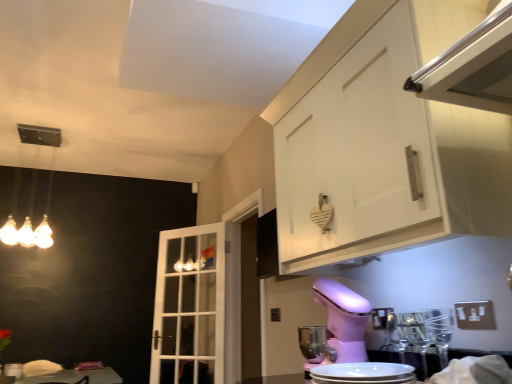
Question: From a real-world perspective, is white matte cabinet at upper right over matte glass light fixture at upper left?

Choices:
 (A) no
 (B) yes

Answer: (A)

Question: Is white matte cabinet at upper right closer to the viewer compared to matte glass light fixture at upper left?

Choices:
 (A) yes
 (B) no

Answer: (A)

Question: From a real-world perspective, is white matte cabinet at upper right below matte glass light fixture at upper left?

Choices:
 (A) no
 (B) yes

Answer: (B)

Question: From the image's perspective, is white matte cabinet at upper right beneath matte glass light fixture at upper left?

Choices:
 (A) yes
 (B) no

Answer: (B)

Question: Can you confirm if white matte cabinet at upper right is positioned to the left of matte glass light fixture at upper left?

Choices:
 (A) yes
 (B) no

Answer: (B)

Question: Is white matte cabinet at upper right bigger or smaller than matte glass light fixture at upper left?

Choices:
 (A) big
 (B) small

Answer: (A)

Question: Considering the positions of white matte cabinet at upper right and matte glass light fixture at upper left in the image, is white matte cabinet at upper right taller or shorter than matte glass light fixture at upper left?

Choices:
 (A) short
 (B) tall

Answer: (A)

Question: Is white matte cabinet at upper right to the left or to the right of matte glass light fixture at upper left in the image?

Choices:
 (A) left
 (B) right

Answer: (B)

Question: Is white matte cabinet at upper right inside the boundaries of matte glass light fixture at upper left, or outside?

Choices:
 (A) inside
 (B) outside

Answer: (B)

Question: From their relative heights in the image, would you say white glass door at center is taller or shorter than white matte cabinet at upper right?

Choices:
 (A) short
 (B) tall

Answer: (B)

Question: Is point (173, 347) closer or farther from the camera than point (338, 137)?

Choices:
 (A) closer
 (B) farther

Answer: (B)

Question: Choose the correct answer: Is white glass door at center inside white matte cabinet at upper right or outside it?

Choices:
 (A) outside
 (B) inside

Answer: (A)

Question: Looking at their shapes, would you say white glass door at center is wider or thinner than white matte cabinet at upper right?

Choices:
 (A) wide
 (B) thin

Answer: (B)

Question: From the image's perspective, is pink plastic mixer at lower center positioned above or below pink plastic stand mixer at lower center?

Choices:
 (A) above
 (B) below

Answer: (B)

Question: Does point (355, 334) appear closer or farther from the camera than point (330, 380)?

Choices:
 (A) farther
 (B) closer

Answer: (A)